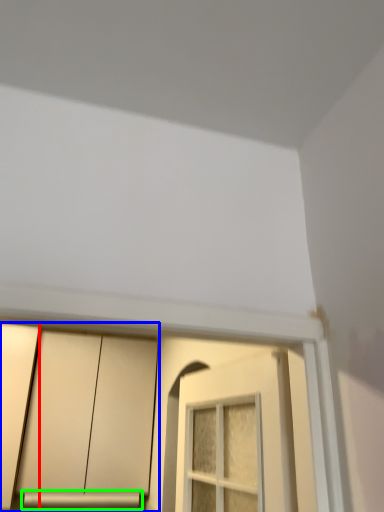
Question: Which object is positioned closest to door (highlighted by a red box)? Select from cabinetry (highlighted by a blue box) and window sill (highlighted by a green box).

Choices:
 (A) cabinetry
 (B) window sill

Answer: (A)